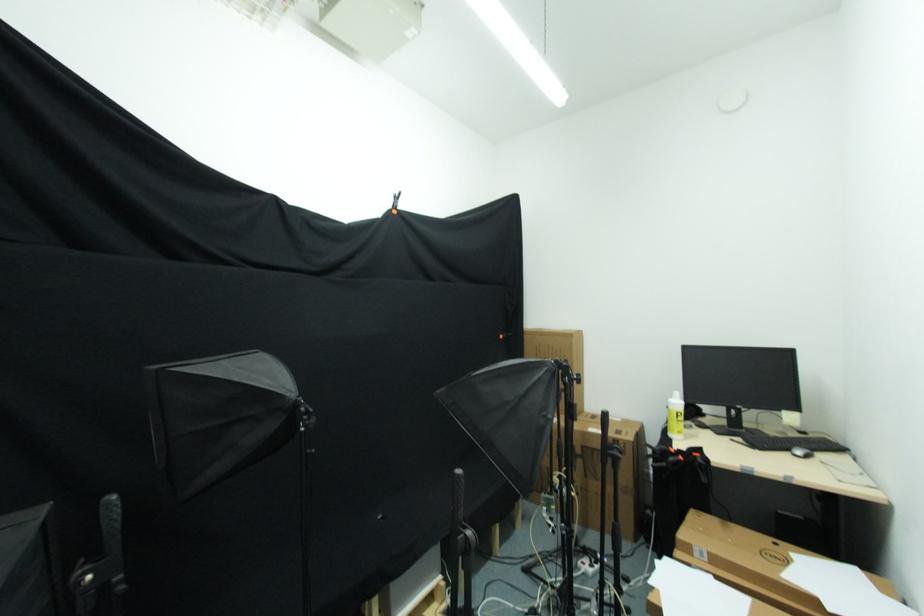
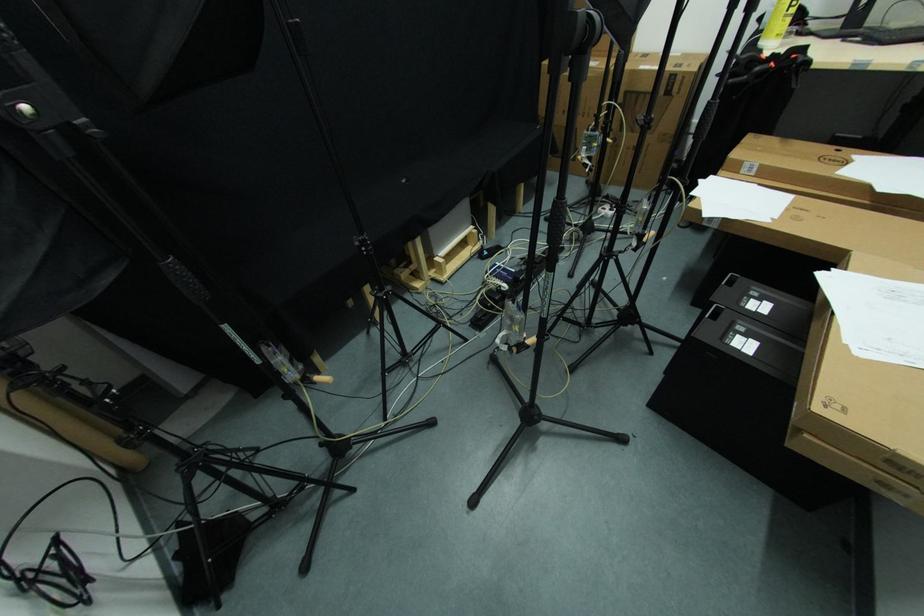
The point at (623,446) is marked in the first image. Where is the corresponding point in the second image?

(679, 81)